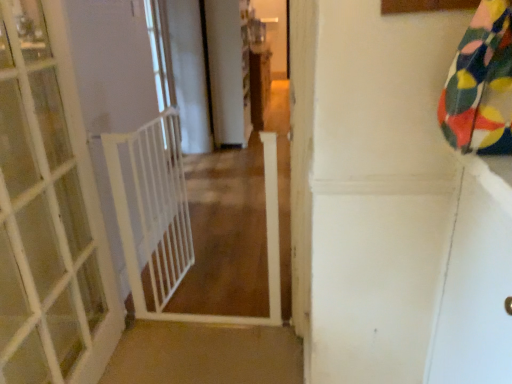
Question: From the image's perspective, is white plastic gate at left on white plastic gate at center?

Choices:
 (A) no
 (B) yes

Answer: (B)

Question: Is white plastic gate at left facing away from white plastic gate at center?

Choices:
 (A) no
 (B) yes

Answer: (A)

Question: Can you confirm if white plastic gate at left is smaller than white plastic gate at center?

Choices:
 (A) no
 (B) yes

Answer: (A)

Question: Can you confirm if white plastic gate at left is thinner than white plastic gate at center?

Choices:
 (A) yes
 (B) no

Answer: (A)

Question: Considering the relative sizes of white plastic gate at left and white plastic gate at center in the image provided, is white plastic gate at left wider than white plastic gate at center?

Choices:
 (A) yes
 (B) no

Answer: (B)

Question: From a real-world perspective, is white plastic gate at left located beneath white plastic gate at center?

Choices:
 (A) yes
 (B) no

Answer: (B)

Question: From the image's perspective, would you say white plastic gate at center is shown under white plastic gate at left?

Choices:
 (A) no
 (B) yes

Answer: (B)

Question: Is white plastic gate at center closer to the viewer compared to white plastic gate at left?

Choices:
 (A) no
 (B) yes

Answer: (B)

Question: Would you say white plastic gate at center contains white plastic gate at left?

Choices:
 (A) no
 (B) yes

Answer: (A)

Question: Does white plastic gate at center lie behind white plastic gate at left?

Choices:
 (A) yes
 (B) no

Answer: (B)

Question: Would you say white plastic gate at center is a long distance from white plastic gate at left?

Choices:
 (A) yes
 (B) no

Answer: (A)

Question: Is white plastic gate at center smaller than white plastic gate at left?

Choices:
 (A) no
 (B) yes

Answer: (B)

Question: Can you confirm if white plastic gate at center is wider than white plastic balustrade at left?

Choices:
 (A) yes
 (B) no

Answer: (A)